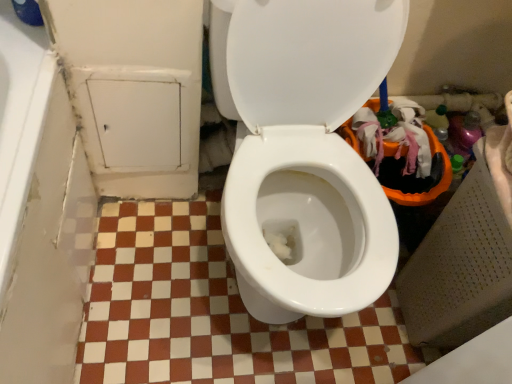
The height and width of the screenshot is (384, 512). Describe the element at coordinates (213, 313) in the screenshot. I see `checkerboard ceramic tile at center` at that location.

This screenshot has height=384, width=512. I want to click on checkerboard ceramic tile at center, so click(213, 313).

At what (x,y) coordinates should I click in order to perform the action: click on checkerboard ceramic tile at center. Please return your answer as a coordinate pair (x, y). This screenshot has height=384, width=512. Looking at the image, I should click on (213, 313).